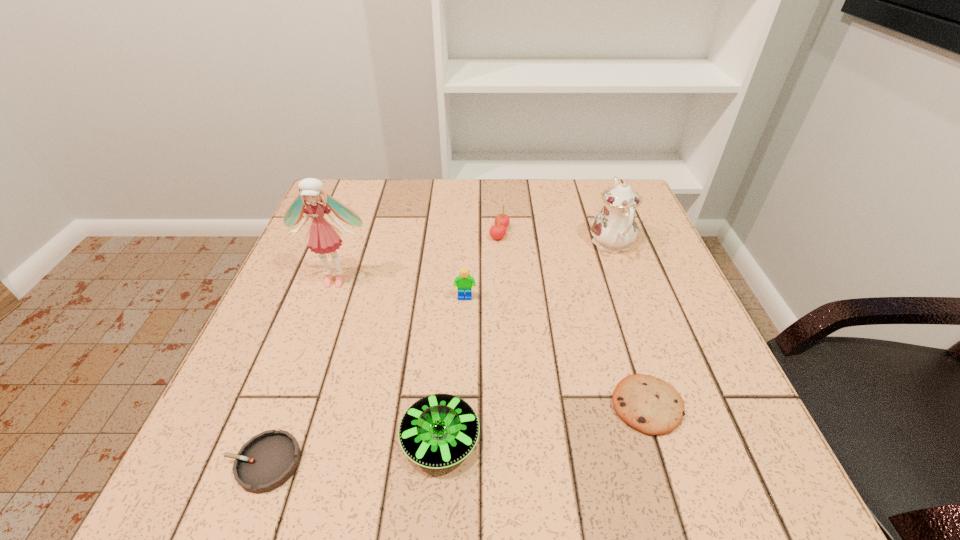
Identify the location of vacant space at the near right corner of the desktop. (688, 447).

Where is `free space between the saucer and the chinaware`? The height and width of the screenshot is (540, 960). free space between the saucer and the chinaware is located at coordinates (526, 341).

Locate an element on the screen. free space that is in between the fifth shortest object and the fifth object from left to right is located at coordinates (482, 266).

Find the location of a particular element. free space that is in between the chinaware and the fourth nearest object is located at coordinates (539, 271).

Where is `unoccupied position between the saucer and the fifth nearest object`? The width and height of the screenshot is (960, 540). unoccupied position between the saucer and the fifth nearest object is located at coordinates (388, 359).

Locate an element on the screen. vacant point located between the second tallest object and the cookie is located at coordinates (629, 325).

I want to click on empty space between the doll and the shortest object, so click(x=300, y=371).

Identify the location of empty space between the third farthest object and the chinaware. Image resolution: width=960 pixels, height=540 pixels. (473, 261).

Find the location of a particular element. object that is the fifth closest to the cherry is located at coordinates (440, 430).

Locate an element on the screen. object that is the fourth closest one to the doll is located at coordinates click(x=265, y=462).